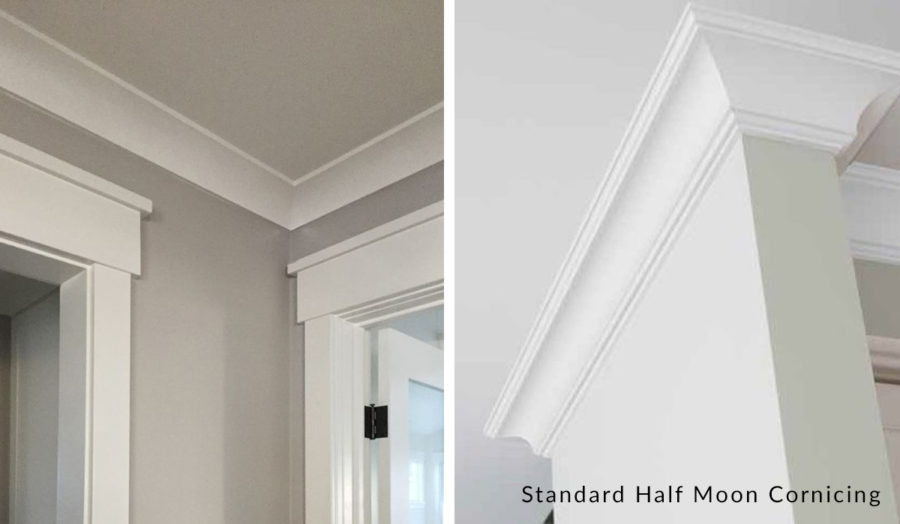
This screenshot has height=524, width=900. Identify the location of wall. (187, 441).